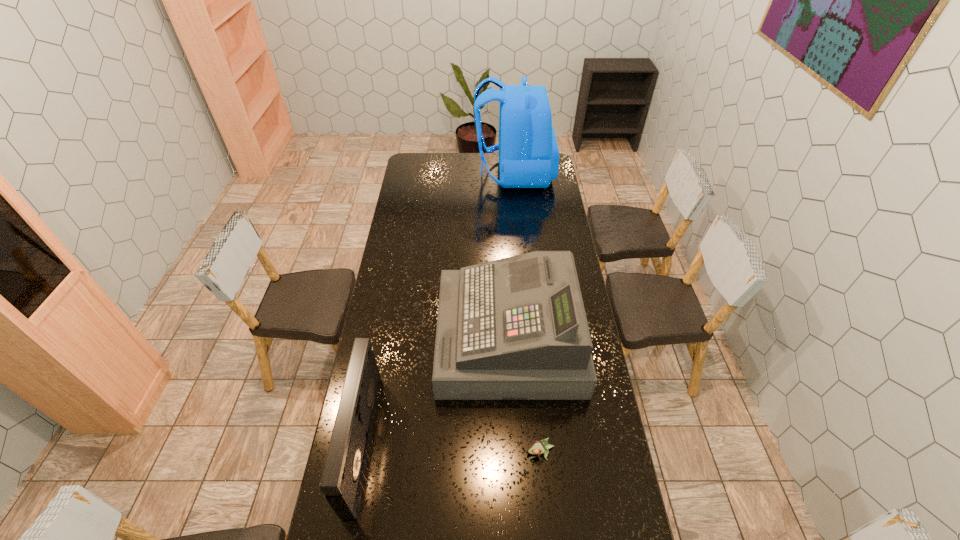
Where is `backpack`? This screenshot has height=540, width=960. backpack is located at coordinates (528, 151).

Locate an element on the screen. The height and width of the screenshot is (540, 960). the farthest object is located at coordinates (528, 151).

What are the coordinates of `the third shortest object` in the screenshot? It's located at (515, 328).

Find the location of a particular element. This screenshot has height=540, width=960. the third tallest object is located at coordinates (343, 473).

You are a GUI agent. You are given a task and a screenshot of the screen. Output one action in this format:
    pyautogui.click(x=<x>, y=<y>)
    Task: Click on the videotape
    The image size is (960, 540).
    Given the screenshot: What is the action you would take?
    pyautogui.click(x=343, y=473)

Find the location of a particular element. This screenshot has width=960, height=540. the shortest object is located at coordinates (537, 447).

Identify the location of free space located on the back of the farthest object. (418, 173).

Where is `free region located 0.250m on the back of the farthest object`? The height and width of the screenshot is (540, 960). free region located 0.250m on the back of the farthest object is located at coordinates (432, 173).

Identify the location of vacant region located 0.370m on the back of the farthest object. (412, 173).

Image resolution: width=960 pixels, height=540 pixels. Find the location of `vacant space situated 0.110m on the front-facing side of the cash register`. vacant space situated 0.110m on the front-facing side of the cash register is located at coordinates (412, 339).